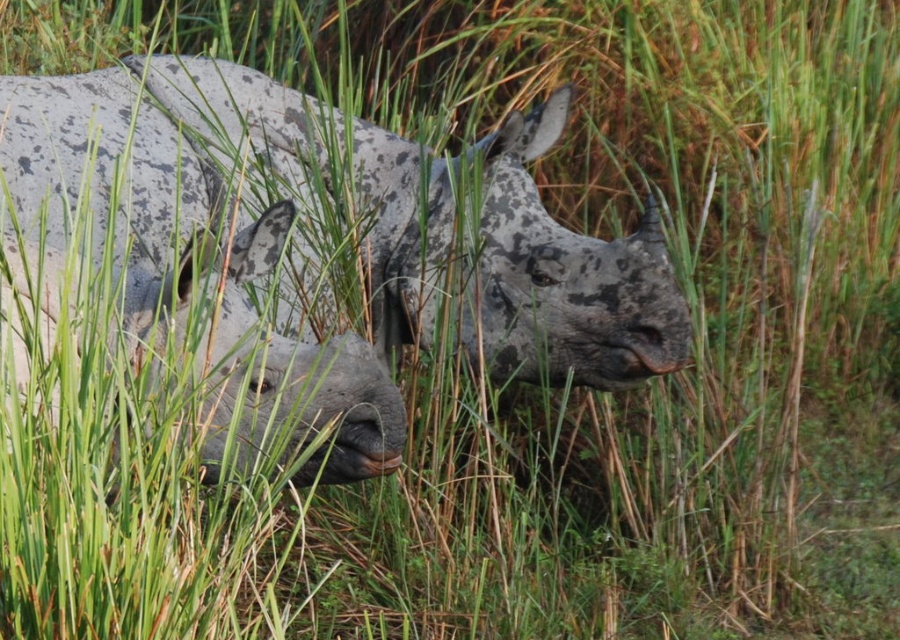
You are a wildlife photographer aiming to capture a close shot of the speckled gray rhinoceros at center. Your camera has a minimum focusing distance of 3 meters. Can you take a clear photo without moving closer?

The speckled gray rhinoceros at center is 3.48 meters away from viewer, so yes, you can take a clear photo since the distance is within the camera minimum focusing distance of 3 meters.

You are a wildlife photographer aiming to capture both the speckled gray rhinoceros at center and the gray textured rhino at left in a single frame. Based on their positions, which rhinoceros would appear closer to the top of the photo?

The speckled gray rhinoceros at center is located above the gray textured rhino at left, so it would appear closer to the top of the photo.

You are a wildlife photographer aiming to capture a clear shot of both the speckled gray rhinoceros at center and the gray textured rhino at left. Based on their positions, which rhino would appear larger in your photo?

The speckled gray rhinoceros at center appears closer to the viewer than the gray textured rhino at left, so it would appear larger in the photo.